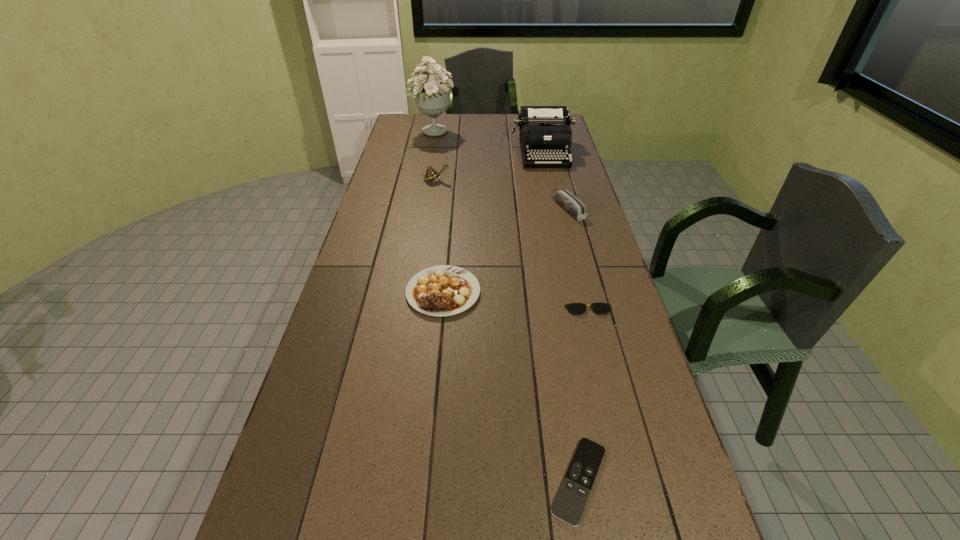
In order to click on vacant area situated 0.340m on the typing side of the sixth shortest object in this screenshot , I will do `click(556, 214)`.

You are a GUI agent. You are given a task and a screenshot of the screen. Output one action in this format:
    pyautogui.click(x=<x>, y=<y>)
    Task: Click on the vacant space located 0.080m on the face of the third tallest object
    The image size is (960, 540).
    Given the screenshot: What is the action you would take?
    click(x=469, y=180)

Find the location of `free spot located on the back of the pencil box`. free spot located on the back of the pencil box is located at coordinates (557, 163).

At what (x,y) coordinates should I click in order to perform the action: click on vacant space located on the back of the third shortest object. Please return your answer as a coordinate pair (x, y). Image resolution: width=960 pixels, height=540 pixels. Looking at the image, I should click on (447, 241).

You are a GUI agent. You are given a task and a screenshot of the screen. Output one action in this format:
    pyautogui.click(x=<x>, y=<y>)
    Task: Click on the vacant space located on the front of the spectacles
    The image size is (960, 540).
    Given the screenshot: What is the action you would take?
    pyautogui.click(x=621, y=438)

Where is `vacant space positioned on the back of the nearest object`? vacant space positioned on the back of the nearest object is located at coordinates (551, 309).

Find the location of a particular element. Image resolution: width=960 pixels, height=540 pixels. object at the far edge is located at coordinates (433, 98).

This screenshot has width=960, height=540. Identify the location of object located at the left edge. (433, 98).

You are a GUI agent. You are given a task and a screenshot of the screen. Output one action in this format:
    pyautogui.click(x=<x>, y=<y>)
    Task: Click on the typewriter located in the right edge section of the desktop
    The height and width of the screenshot is (540, 960).
    Given the screenshot: What is the action you would take?
    pyautogui.click(x=545, y=134)

Locate an element on the screen. The image size is (960, 540). pencil box that is at the right edge is located at coordinates (568, 201).